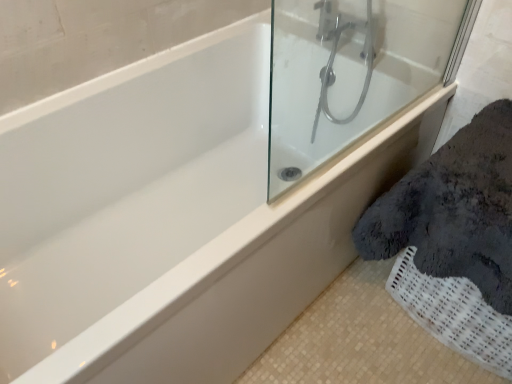
Image resolution: width=512 pixels, height=384 pixels. What do you see at coordinates (454, 210) in the screenshot? I see `dark gray plush bath towel at lower right` at bounding box center [454, 210].

Locate an element on the screen. dark gray plush bath towel at lower right is located at coordinates (454, 210).

Measure the distance between dark gray plush bath towel at lower right and camera.

35.77 inches.

Find the location of a particular element. This screenshot has width=512, height=384. dark gray plush bath towel at lower right is located at coordinates (454, 210).